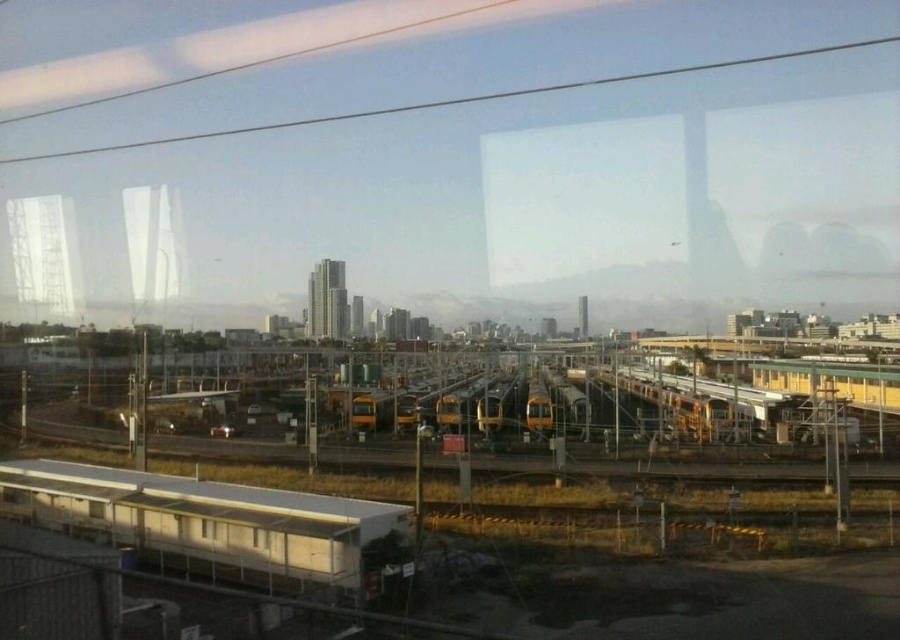
What do you see at coordinates (96, 509) in the screenshot? I see `transparent glass window at lower left` at bounding box center [96, 509].

Between point (90, 506) and point (207, 536), which one is positioned in front?

Point (207, 536) is more forward.

At what (x,y) coordinates should I click in order to perform the action: click on transparent glass window at lower left. Please return your answer as a coordinate pair (x, y). Looking at the image, I should click on (96, 509).

Who is more forward, [169,529] or [204,518]?

Point [204,518]

Which is more to the right, white matte platform at lower left or transparent glass window at lower center?

transparent glass window at lower center

Is point (240, 538) in front of point (210, 522)?

Yes, point (240, 538) is in front of point (210, 522).

This screenshot has height=640, width=900. What are the coordinates of `white matte platform at lower left` in the screenshot? It's located at (212, 522).

The width and height of the screenshot is (900, 640). What do you see at coordinates (212, 522) in the screenshot?
I see `white matte platform at lower left` at bounding box center [212, 522].

Does white matte platform at lower left appear on the left side of transparent glass window at lower left?

No, white matte platform at lower left is not to the left of transparent glass window at lower left.

The width and height of the screenshot is (900, 640). In order to click on white matte platform at lower left in this screenshot , I will do `click(212, 522)`.